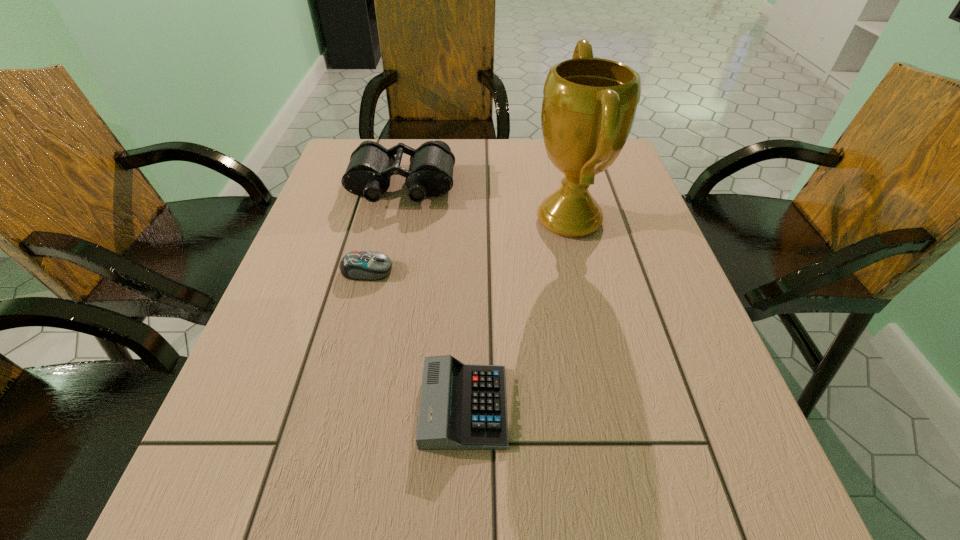
Locate an element on the screen. award is located at coordinates (589, 105).

Where is `the tallest object`? the tallest object is located at coordinates (589, 105).

The image size is (960, 540). I want to click on the second tallest object, so click(x=430, y=174).

At what (x,y) coordinates should I click in order to perform the action: click on computer mouse. Please return your answer as a coordinate pair (x, y). The height and width of the screenshot is (540, 960). Looking at the image, I should click on (358, 265).

Where is `the nearest object`? The width and height of the screenshot is (960, 540). the nearest object is located at coordinates (462, 406).

At what (x,y) coordinates should I click in order to perform the action: click on free space located 0.260m on the front of the rightmost object with the decoration. Please return your answer as a coordinate pair (x, y). This screenshot has width=960, height=540. Looking at the image, I should click on (421, 220).

Where is `vacant space located 0.060m on the front of the rightmost object with the decoration`? vacant space located 0.060m on the front of the rightmost object with the decoration is located at coordinates (506, 220).

Where is `vacant space located on the front of the rightmost object with the decoration`? The image size is (960, 540). vacant space located on the front of the rightmost object with the decoration is located at coordinates (485, 220).

What are the coordinates of `blank area located through the eyepieces of the binoculars` in the screenshot? It's located at (376, 300).

Locate an element on the screen. The height and width of the screenshot is (540, 960). vacant point located on the wheel side of the computer mouse is located at coordinates 578,271.